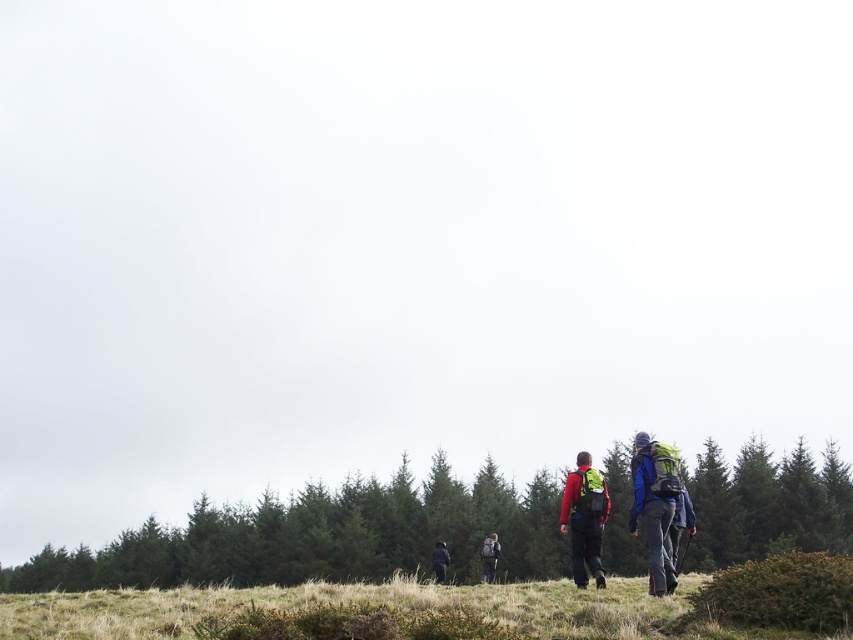
You are a hiker who just arrived at the scene. You need to locate your green fabric backpack at center. Where should you look?

The green fabric backpack at center is located at point (x=489, y=557).

You are a photographer positioned at the edge of the grassy field. You want to capture a photo of the dark green jacket at center without the green fabric backpack at center blocking it. Is this possible based on their positions?

The green fabric backpack at center is above the dark green jacket at center, so the backpack is positioned higher in the frame. This means the backpack would block the view of the jacket unless you adjust your angle or move closer to lower your perspective.

You are a hiker standing at the starting point of the trail. You see the matte red jacket at center and the dark green jacket at center ahead of you. Which jacket is closer to you?

The matte red jacket at center is 21.09 meters away from the dark green jacket at center, so the dark green jacket at center is closer to you since it is positioned behind the matte red jacket at center.